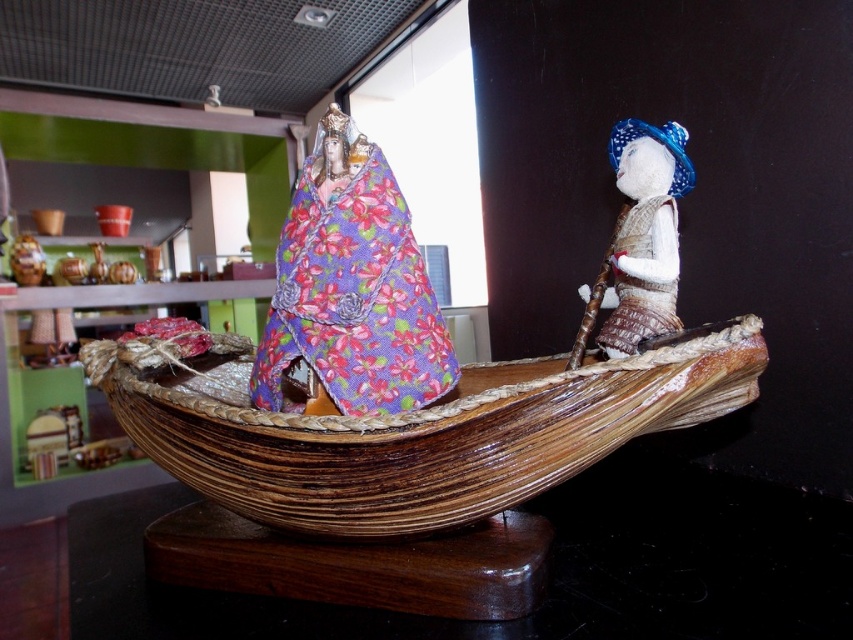
You are a customer in a shop looking at the wooden boat at center and the textured beige doll at right. If you want to touch both items, which one should you reach for first without moving your position?

You should reach for the wooden boat at center first because it is closer to you than the textured beige doll at right.

You are a customer in a gift shop and want to buy both the wooden boat at center and the textured beige doll at right. If you have a box that can only fit one of them, which object should you choose to fit into the box?

The wooden boat at center is bigger than the textured beige doll at right, so the box can only fit the textured beige doll at right.